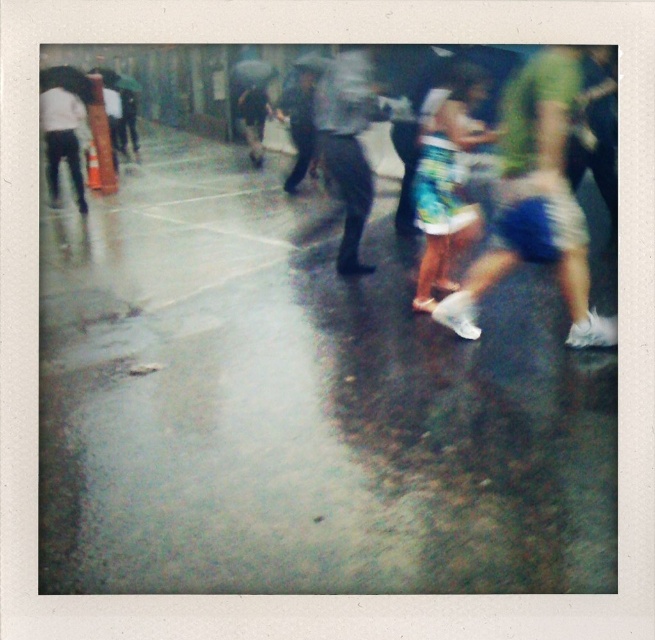
You are a photographer trying to capture a detailed shot of the blue denim shorts at center and the dark blue jeans at center in the rainy street scene. Based on their positions, which clothing item is wider?

The blue denim shorts at center might be wider than dark blue jeans at center according to the description.

You are standing at the bottom left corner of the image and want to walk to the blue denim shorts at center. Which direction should you head towards?

Since the blue denim shorts at center is located at point 0.314 on the x axis and 0.818 on the y axis, you should head towards the upper right direction from the bottom left corner to reach it.